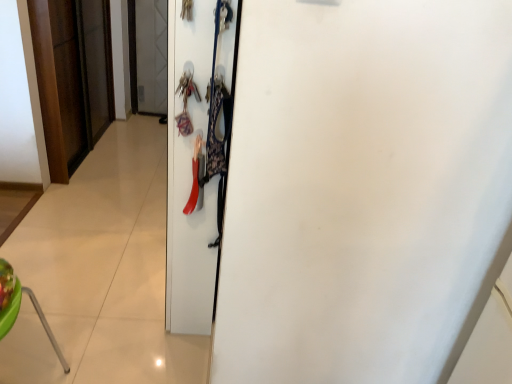
I want to click on vacant area that lies between wooden door at left, which is the 1th door in back-to-front order, and white matte door at center, which is the first door in right-to-left order, so click(118, 197).